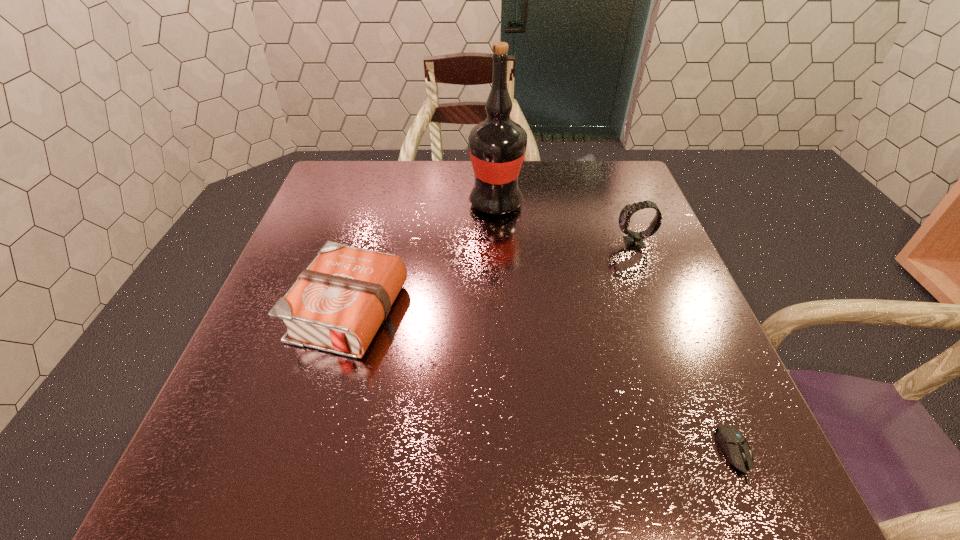
Identify the location of vacant area at the far edge of the desktop. (568, 167).

Locate an element on the screen. vacant region at the near edge is located at coordinates (309, 480).

The width and height of the screenshot is (960, 540). Identify the location of free region at the left edge of the desktop. (316, 249).

You are a GUI agent. You are given a task and a screenshot of the screen. Output one action in this format:
    pyautogui.click(x=<x>, y=<y>)
    Task: Click on the vacant region at the right edge of the desktop
    The image size is (960, 540).
    Given the screenshot: What is the action you would take?
    pyautogui.click(x=653, y=289)

This screenshot has width=960, height=540. In order to click on free location at the far left corner of the desktop in this screenshot , I will do `click(339, 188)`.

This screenshot has height=540, width=960. In order to click on free spot at the near left corner of the desktop in this screenshot , I will do `click(245, 472)`.

Identify the location of blank space at the far right corner of the desktop. This screenshot has height=540, width=960. (628, 174).

Where is `vacant area that lies between the farthest object and the second tallest object`? vacant area that lies between the farthest object and the second tallest object is located at coordinates (564, 224).

At what (x,y) coordinates should I click in order to perform the action: click on vacant area between the nearest object and the second tallest object. Please return your answer as a coordinate pair (x, y). The width and height of the screenshot is (960, 540). Looking at the image, I should click on (684, 348).

You are a GUI agent. You are given a task and a screenshot of the screen. Output one action in this format:
    pyautogui.click(x=<x>, y=<y>)
    Task: Click on the empty space that is in between the Bible and the second farthest object
    Image resolution: width=960 pixels, height=540 pixels.
    Given the screenshot: What is the action you would take?
    (492, 278)